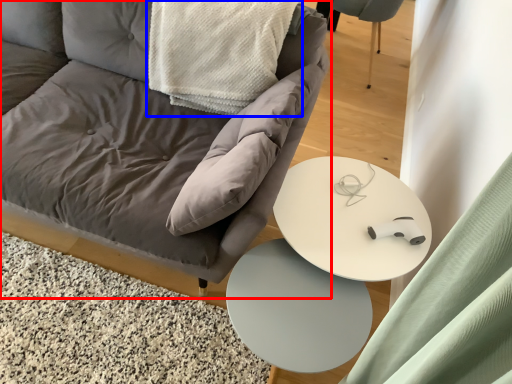
Question: Among these objects, which one is nearest to the camera, chair (highlighted by a red box) or material (highlighted by a blue box)?

Choices:
 (A) chair
 (B) material

Answer: (A)